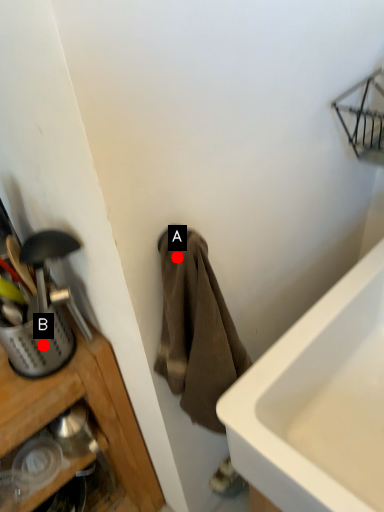
Question: Two points are circled on the image, labeled by A and B beside each circle. Which point appears closest to the camera in this image?

Choices:
 (A) A is closer
 (B) B is closer

Answer: (A)